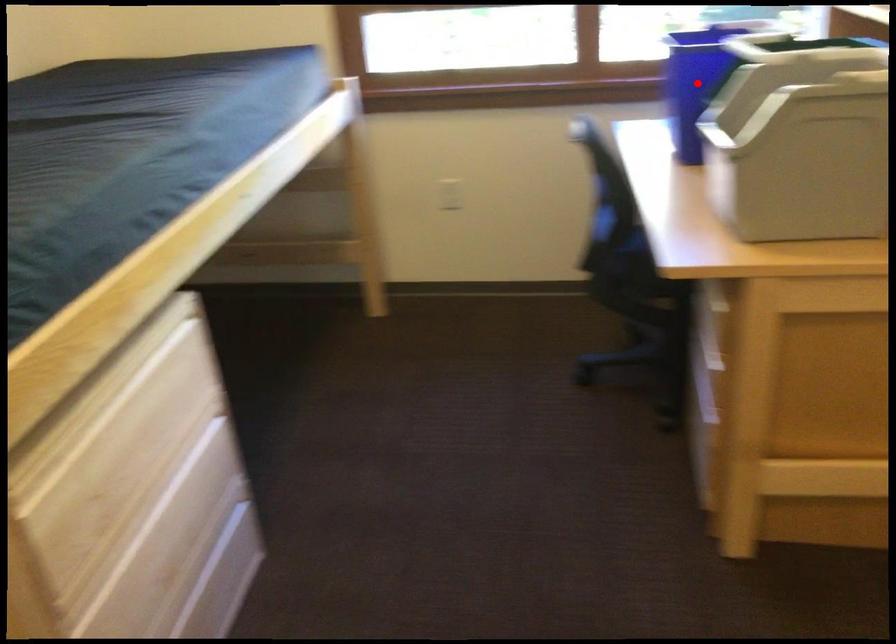
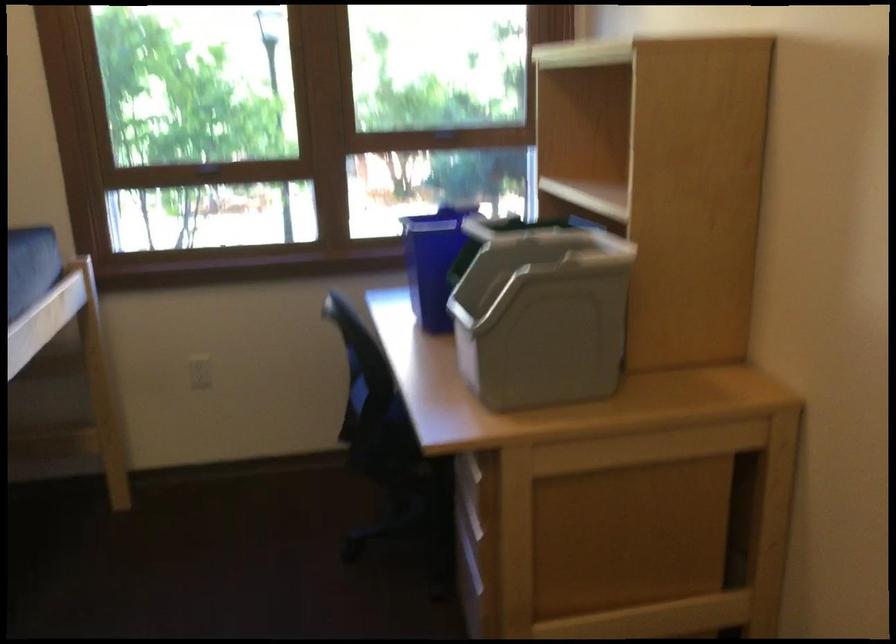
In the second image, find the point that corresponds to the highlighted location in the first image.

(433, 261)